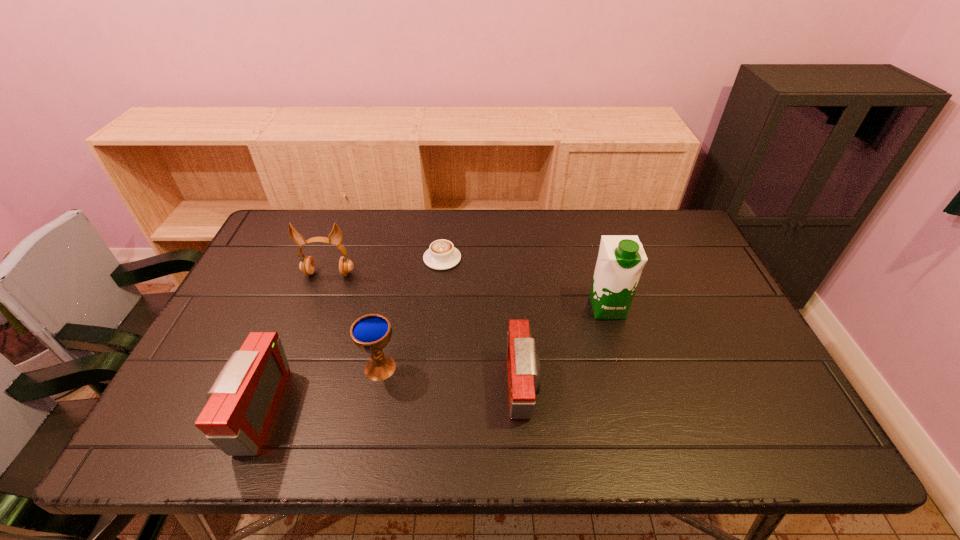
At what (x,y) coordinates should I click in order to perform the action: click on object that stands as the second closest to the fifth shortest object. Please return your answer as a coordinate pair (x, y). The image size is (960, 540). Looking at the image, I should click on (370, 333).

I want to click on free space that satisfies the following two spatial constraints: 1. on the front-facing side of the tallest object; 2. on the front-facing side of the fifth object from left to right, so click(x=630, y=387).

Where is `free space that satisfies the following two spatial constraints: 1. on the front-facing side of the chalice; 2. on the left side of the fifth shortest object`? Image resolution: width=960 pixels, height=540 pixels. free space that satisfies the following two spatial constraints: 1. on the front-facing side of the chalice; 2. on the left side of the fifth shortest object is located at coordinates (294, 368).

Locate an element on the screen. This screenshot has width=960, height=540. vacant position in the image that satisfies the following two spatial constraints: 1. on the front-facing side of the chalice; 2. on the right side of the fifth shortest object is located at coordinates pyautogui.click(x=294, y=368).

Find the location of a particular element. This screenshot has height=540, width=960. blank area in the image that satisfies the following two spatial constraints: 1. on the front-facing side of the second tallest object; 2. on the front-facing side of the taller camera is located at coordinates (278, 411).